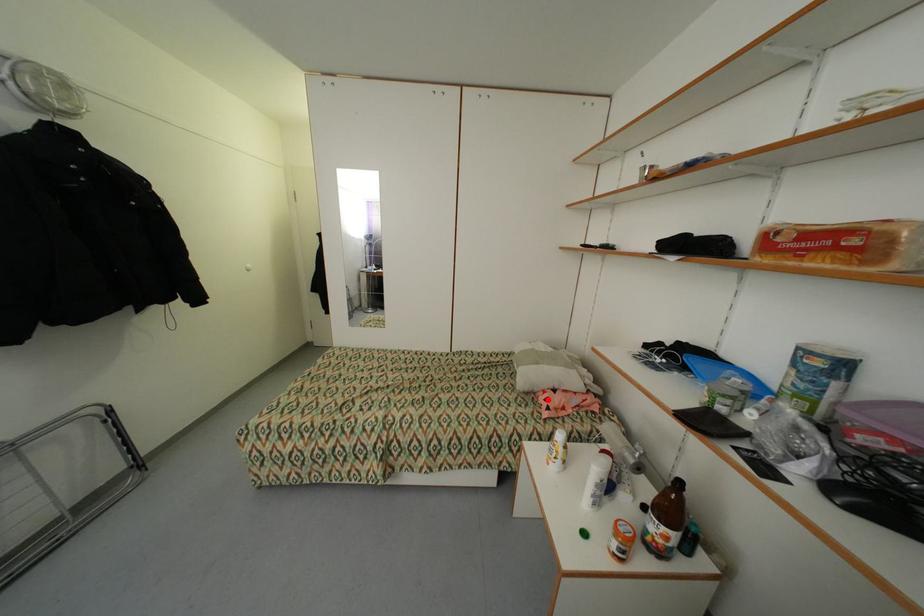
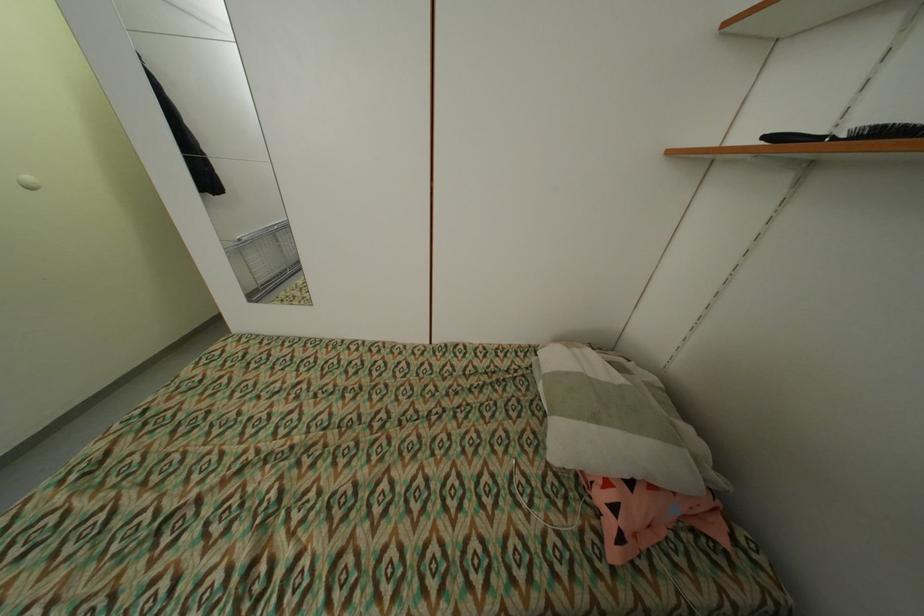
Question: I am providing you with two images of the same scene from different viewpoints. Image1 has a red point marked. In image2, the corresponding 3D location appears at what relative position? Reply with the corresponding letter.

Choices:
 (A) Closer
 (B) Farther

Answer: (A)